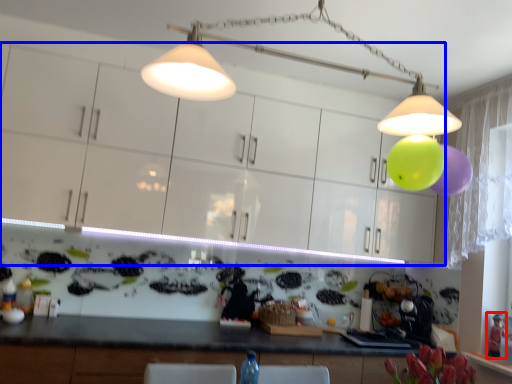
Question: Among these objects, which one is nearest to the camera, toy (highlighted by a red box) or cabinetry (highlighted by a blue box)?

Choices:
 (A) toy
 (B) cabinetry

Answer: (B)